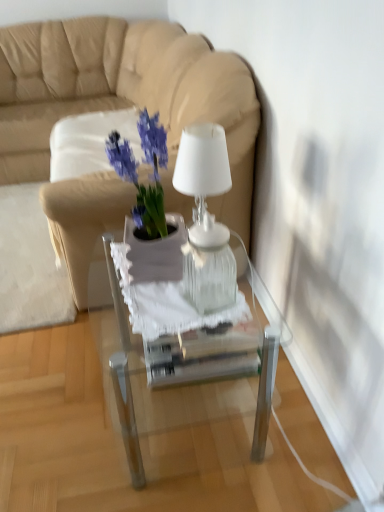
Question: From their relative heights in the image, would you say matte purple plant at center is taller or shorter than beige leather couch at upper left?

Choices:
 (A) short
 (B) tall

Answer: (A)

Question: Would you say matte purple plant at center is inside or outside beige leather couch at upper left?

Choices:
 (A) inside
 (B) outside

Answer: (B)

Question: Which object is positioned farthest from the beige leather couch at upper left?

Choices:
 (A) clear glass table at center
 (B) matte purple plant at center
 (C) transparent glass box at center
 (D) transparent glass lamp at center

Answer: (C)

Question: Estimate the real-world distances between objects in this image. Which object is farther from the transparent glass lamp at center?

Choices:
 (A) transparent glass box at center
 (B) clear glass table at center
 (C) beige leather couch at upper left
 (D) matte purple plant at center

Answer: (C)